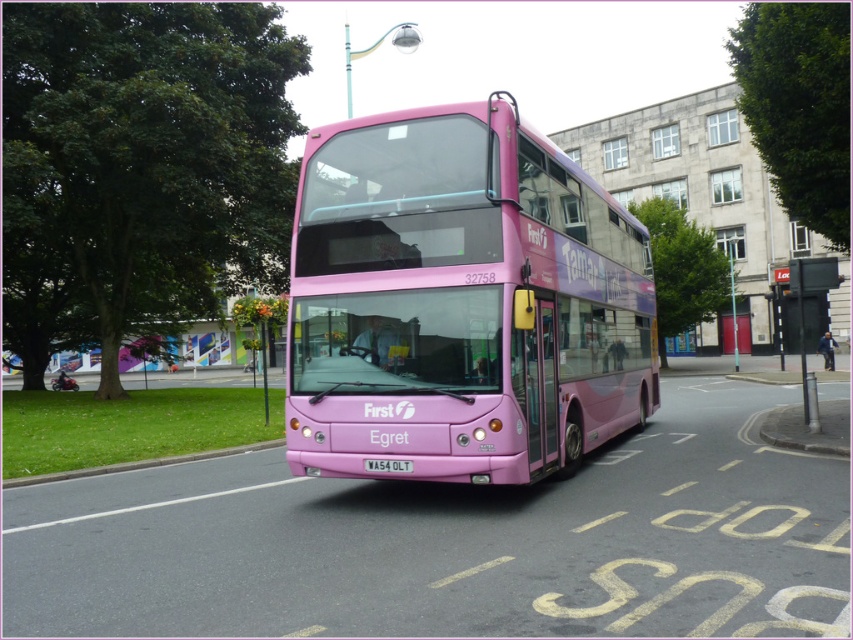
Question: Does pink matte bus at center come behind white plastic license plate at center?

Choices:
 (A) no
 (B) yes

Answer: (A)

Question: Which of the following is the closest to the observer?

Choices:
 (A) (381, 141)
 (B) (367, 465)

Answer: (B)

Question: Is green grass at lower left positioned in front of white plastic license plate at center?

Choices:
 (A) yes
 (B) no

Answer: (B)

Question: Can you confirm if green grass at lower left is thinner than white plastic license plate at center?

Choices:
 (A) yes
 (B) no

Answer: (B)

Question: Which of the following is the closest to the observer?

Choices:
 (A) (88, 467)
 (B) (375, 330)
 (C) (381, 470)

Answer: (C)

Question: Which point is closer to the camera?

Choices:
 (A) pink matte bus at center
 (B) white plastic license plate at center
 (C) green grass at lower left

Answer: (A)